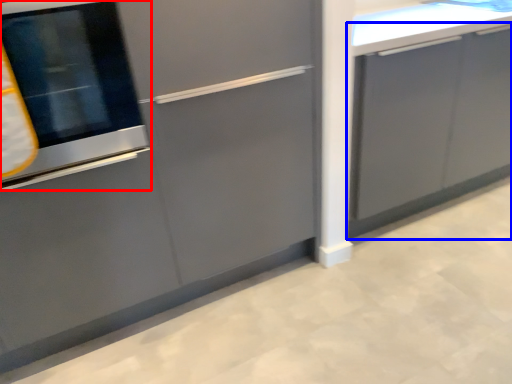
Question: Which object is closer to the camera taking this photo, oven (highlighted by a red box) or cabinetry (highlighted by a blue box)?

Choices:
 (A) oven
 (B) cabinetry

Answer: (A)